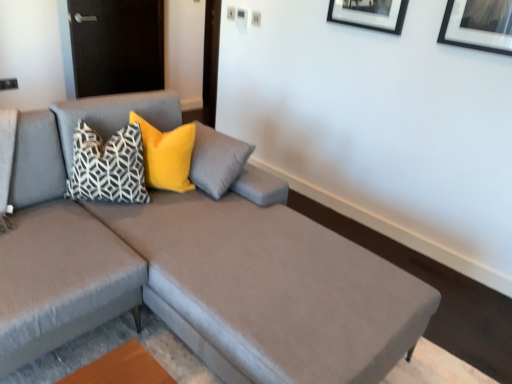
Question: Is point (134, 244) positioned closer to the camera than point (83, 135)?

Choices:
 (A) farther
 (B) closer

Answer: (B)

Question: In terms of width, does textured gray couch at center look wider or thinner when compared to geometric-patterned fabric pillow at center, the second pillow in the right-to-left sequence?

Choices:
 (A) wide
 (B) thin

Answer: (A)

Question: Based on their relative distances, which object is nearer to the textured gray couch at center?

Choices:
 (A) velvet yellow pillow at upper left, arranged as the first pillow when viewed from the right
 (B) geometric-patterned fabric pillow at center, the first pillow from the left

Answer: (B)

Question: Estimate the real-world distances between objects in this image. Which object is closer to the textured gray couch at center?

Choices:
 (A) velvet yellow pillow at upper left, arranged as the first pillow when viewed from the right
 (B) geometric-patterned fabric pillow at center, the second pillow in the right-to-left sequence

Answer: (B)